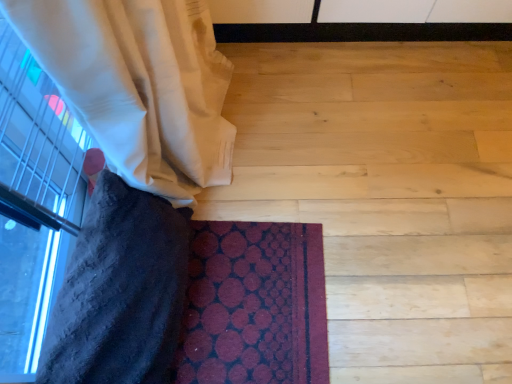
What do you see at coordinates (387, 195) in the screenshot? I see `dark gray carpet at lower left` at bounding box center [387, 195].

Where is `dark gray carpet at lower left`? The height and width of the screenshot is (384, 512). dark gray carpet at lower left is located at coordinates (387, 195).

Measure the distance between point (392, 374) and camera.

4.07 feet.

You are a GUI agent. You are given a task and a screenshot of the screen. Output one action in this format:
    pyautogui.click(x=<x>, y=<y>)
    Task: Click on the dark gray carpet at lower left
    
    Given the screenshot: What is the action you would take?
    pyautogui.click(x=387, y=195)